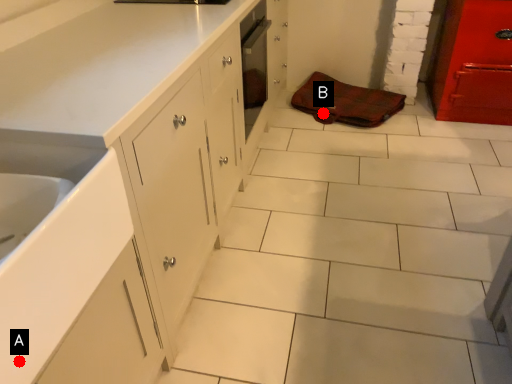
Question: Two points are circled on the image, labeled by A and B beside each circle. Which point is farther to the camera?

Choices:
 (A) A is further
 (B) B is further

Answer: (B)